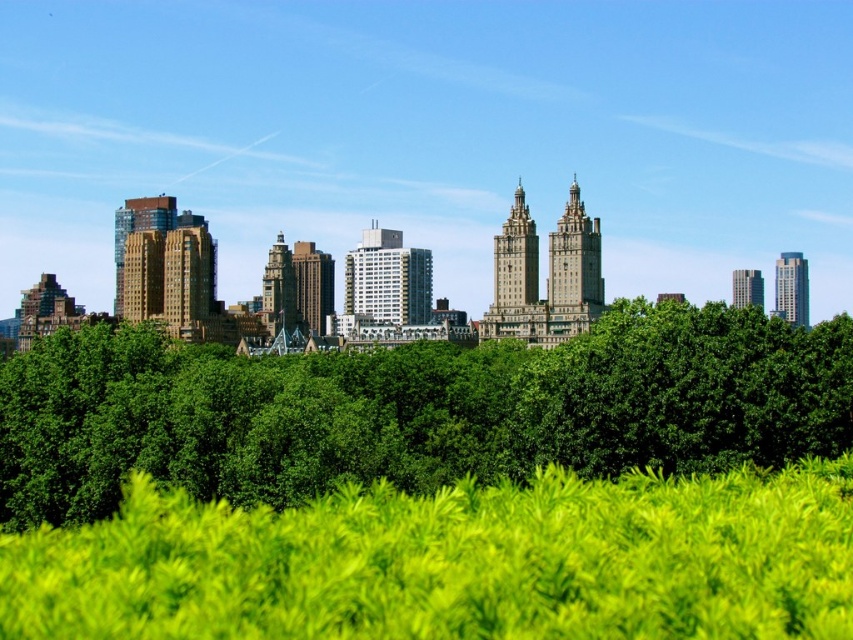
Is green leafy trees at center behind green leafy grass at center?

That is True.

Is point (276, 461) positioned before point (51, 584)?

No, (276, 461) is further to viewer.

Image resolution: width=853 pixels, height=640 pixels. Identify the location of green leafy trees at center. (415, 410).